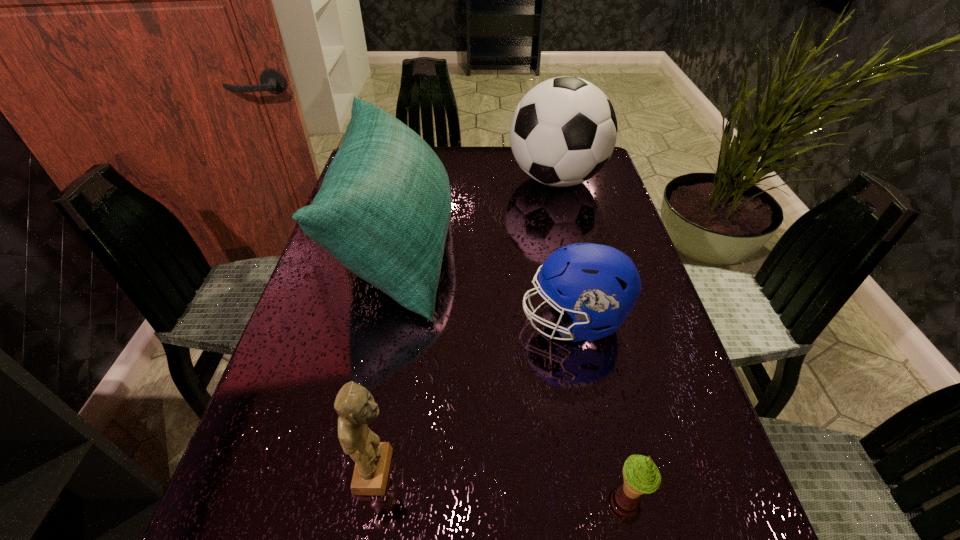
I want to click on blank area located on the front-facing side of the football helmet, so click(367, 320).

You are a GUI agent. You are given a task and a screenshot of the screen. Output one action in this format:
    pyautogui.click(x=<x>, y=<y>)
    Task: Click on the free region located 0.050m on the right of the icecream
    
    Given the screenshot: What is the action you would take?
    pyautogui.click(x=682, y=490)

Image resolution: width=960 pixels, height=540 pixels. Find the location of `object present at the far edge`. object present at the far edge is located at coordinates (563, 132).

Identify the location of object that is at the left edge. The width and height of the screenshot is (960, 540). (383, 210).

Locate an element on the screen. soccer ball present at the right edge is located at coordinates (563, 132).

You are a GUI agent. You are given a task and a screenshot of the screen. Output one action in this format:
    pyautogui.click(x=<x>, y=<y>)
    Task: Click on the football helmet located in the right edge section of the desktop
    The height and width of the screenshot is (540, 960).
    Given the screenshot: What is the action you would take?
    pyautogui.click(x=597, y=285)

This screenshot has height=540, width=960. Identify the location of icecream that is at the right edge. (641, 476).

Where is `object present at the far right corner`? Image resolution: width=960 pixels, height=540 pixels. object present at the far right corner is located at coordinates (563, 132).

Locate an element on the screen. The image size is (960, 540). free space at the left edge of the desktop is located at coordinates (311, 399).

Identify the location of free space at the right edge. The width and height of the screenshot is (960, 540). (593, 192).